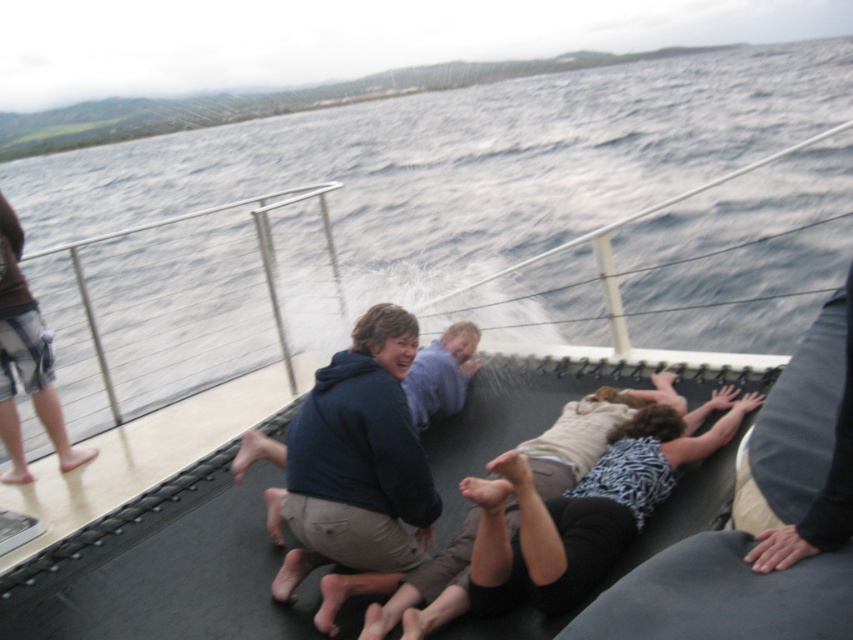
Question: Does white textured shirt at center have a greater width compared to light purple hoodie at center?

Choices:
 (A) yes
 (B) no

Answer: (A)

Question: Which of these objects is positioned closest to the brown denim shorts at left?

Choices:
 (A) white textured shirt at center
 (B) light purple hoodie at center

Answer: (B)

Question: Which point is closer to the camera?

Choices:
 (A) (453, 387)
 (B) (4, 419)
 (C) (704, 454)

Answer: (C)

Question: Which is farther from the light purple hoodie at center?

Choices:
 (A) white textured shirt at center
 (B) brown denim shorts at left

Answer: (B)

Question: Can you confirm if white textured shirt at center is bigger than light purple hoodie at center?

Choices:
 (A) yes
 (B) no

Answer: (A)

Question: Considering the relative positions of white textured shirt at center and light purple hoodie at center in the image provided, where is white textured shirt at center located with respect to light purple hoodie at center?

Choices:
 (A) left
 (B) right

Answer: (B)